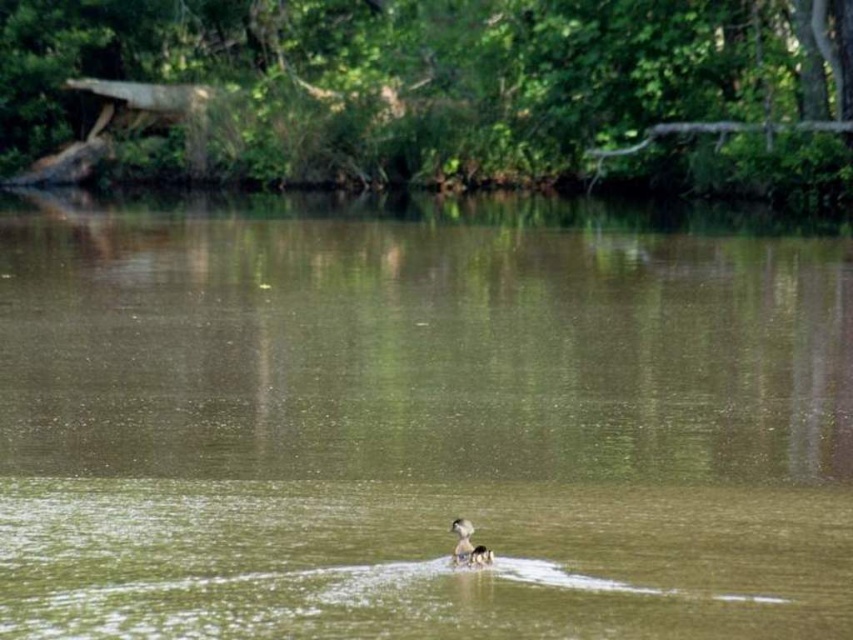
In the scene shown: You are observing two ducks swimming in the water. Which duck is located to the right of the other? The ducks are the white matte duck at center and the brown fuzzy duck at center.

The white matte duck at center is positioned to the right of the brown fuzzy duck at center.

You are standing on the riverbank and see the greenish murky water at center and the brown fuzzy duck at center. Which object is closer to you?

The greenish murky water at center is closer to the viewer than the brown fuzzy duck at center.